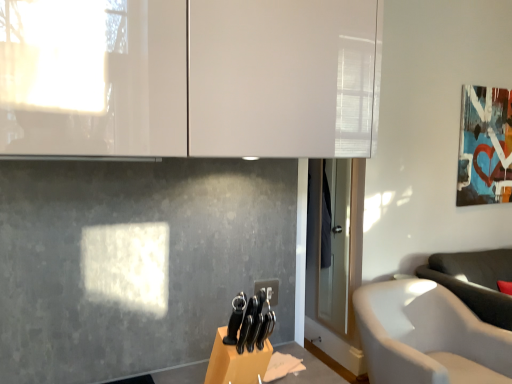
Question: Does matte acrylic picture frame at upper right appear on the left side of white fabric chair at lower right?

Choices:
 (A) yes
 (B) no

Answer: (B)

Question: From the image's perspective, is matte acrylic picture frame at upper right on white fabric chair at lower right?

Choices:
 (A) no
 (B) yes

Answer: (B)

Question: Is matte acrylic picture frame at upper right turned away from white fabric chair at lower right?

Choices:
 (A) yes
 (B) no

Answer: (B)

Question: Is matte acrylic picture frame at upper right smaller than white fabric chair at lower right?

Choices:
 (A) yes
 (B) no

Answer: (A)

Question: Would you consider matte acrylic picture frame at upper right to be distant from white fabric chair at lower right?

Choices:
 (A) no
 (B) yes

Answer: (B)

Question: Is matte acrylic picture frame at upper right shorter than white fabric chair at lower right?

Choices:
 (A) yes
 (B) no

Answer: (B)

Question: Considering the relative sizes of matte acrylic picture frame at upper right and white glossy cabinet at upper center in the image provided, is matte acrylic picture frame at upper right shorter than white glossy cabinet at upper center?

Choices:
 (A) no
 (B) yes

Answer: (A)

Question: Is the position of matte acrylic picture frame at upper right more distant than that of white glossy cabinet at upper center?

Choices:
 (A) yes
 (B) no

Answer: (A)

Question: From a real-world perspective, is matte acrylic picture frame at upper right on top of white glossy cabinet at upper center?

Choices:
 (A) yes
 (B) no

Answer: (B)

Question: Is matte acrylic picture frame at upper right looking in the opposite direction of white glossy cabinet at upper center?

Choices:
 (A) yes
 (B) no

Answer: (B)

Question: Is matte acrylic picture frame at upper right bigger than white glossy cabinet at upper center?

Choices:
 (A) no
 (B) yes

Answer: (A)

Question: Considering the relative sizes of matte acrylic picture frame at upper right and white glossy cabinet at upper center in the image provided, is matte acrylic picture frame at upper right thinner than white glossy cabinet at upper center?

Choices:
 (A) no
 (B) yes

Answer: (B)

Question: From a real-world perspective, is white glossy cabinet at upper center over white fabric chair at lower right?

Choices:
 (A) yes
 (B) no

Answer: (A)